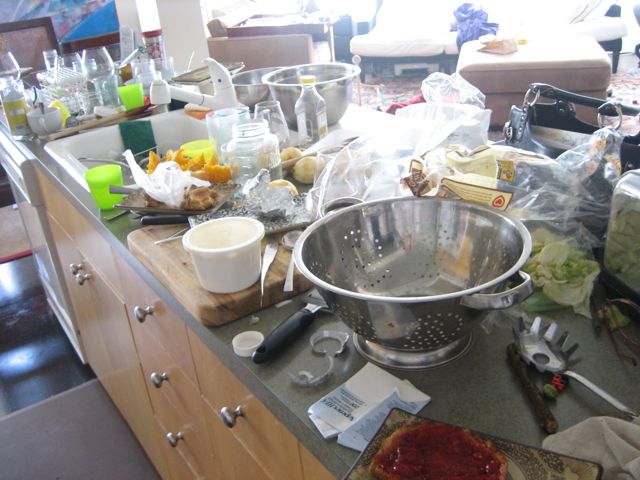
Where is `wineglass`? The image size is (640, 480). wineglass is located at coordinates (8, 63), (70, 71), (96, 66).